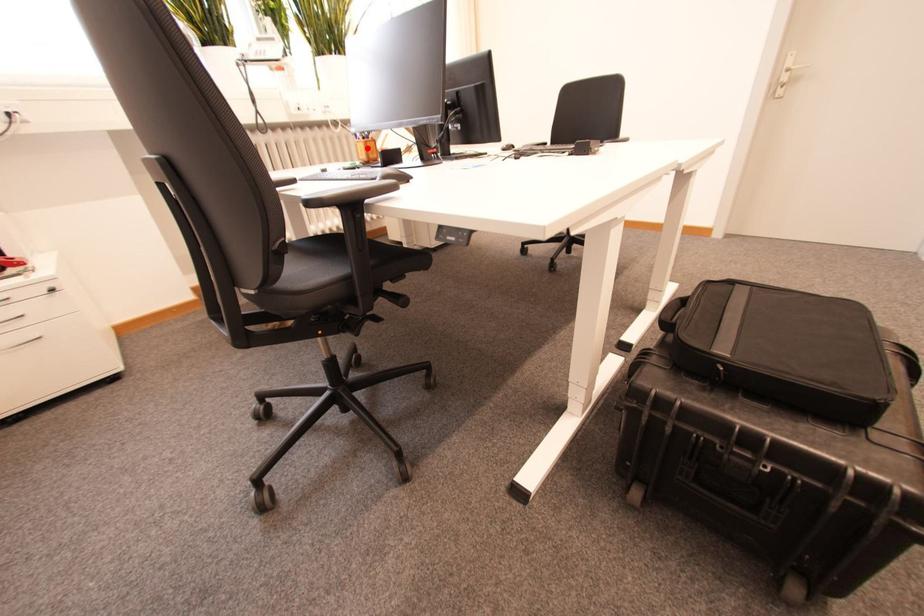
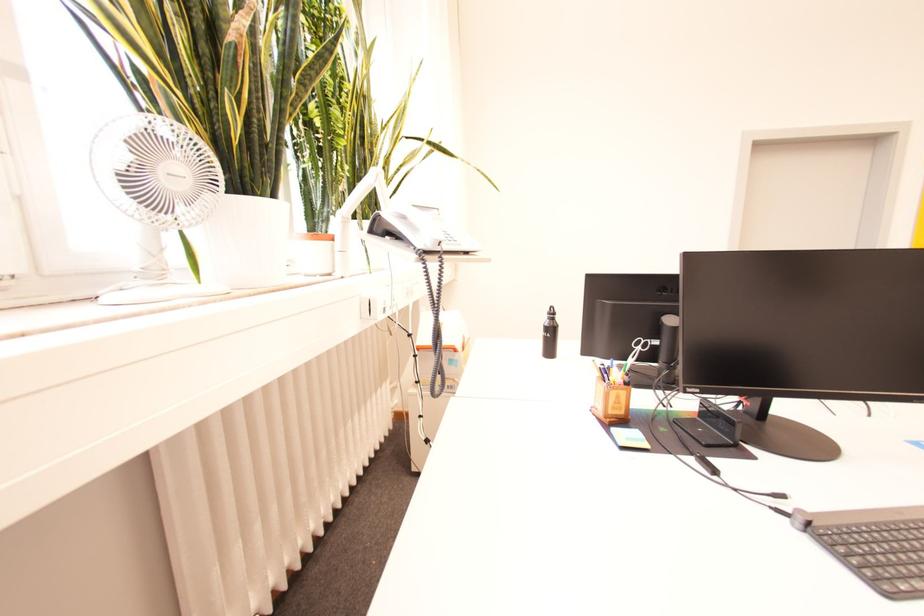
Question: I am providing you with two images of the same scene from different viewpoints. Image1 has a red point marked. In image2, the corresponding 3D location appears at what relative position? Reply with the corresponding letter.

Choices:
 (A) Closer
 (B) Farther

Answer: (B)